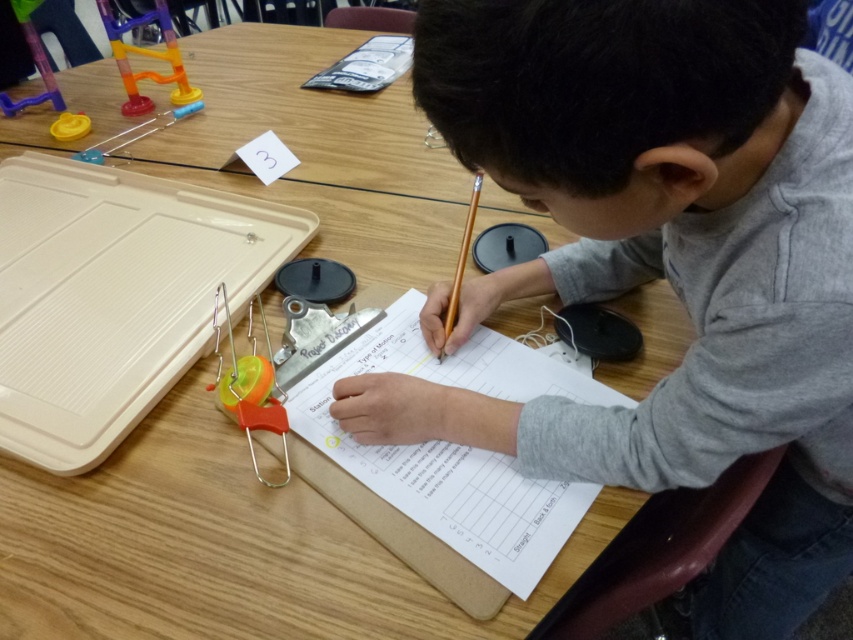
Question: Where is gray cotton shirt at center located in relation to white paper at center in the image?

Choices:
 (A) right
 (B) left

Answer: (A)

Question: Does gray cotton shirt at center appear on the right side of white paper at center?

Choices:
 (A) yes
 (B) no

Answer: (A)

Question: Considering the relative positions of gray cotton shirt at center and white paper at center in the image provided, where is gray cotton shirt at center located with respect to white paper at center?

Choices:
 (A) right
 (B) left

Answer: (A)

Question: Which point is closer to the camera?

Choices:
 (A) white paper at center
 (B) gray cotton shirt at center

Answer: (B)